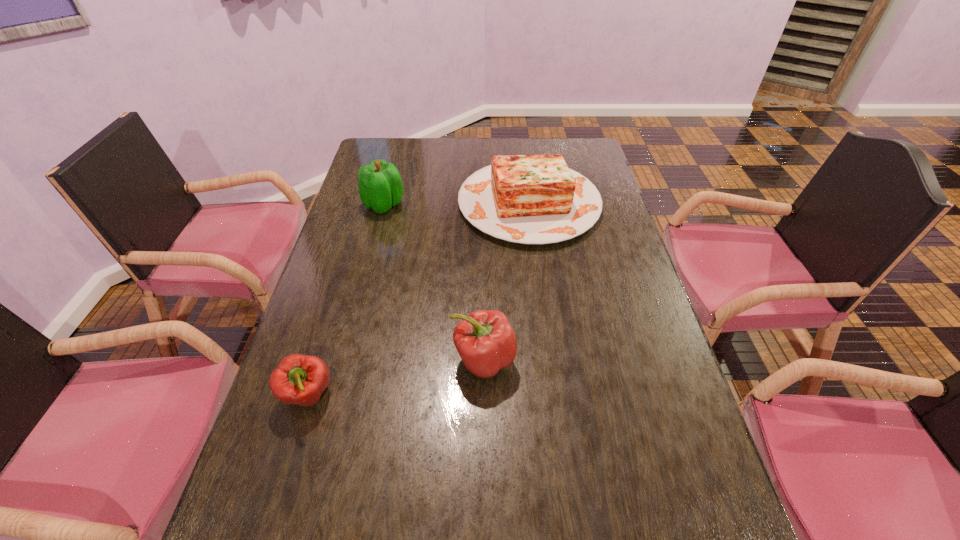
Where is `vacant space that satisfies the following two spatial constraints: 1. on the back side of the rightmost bell pepper; 2. on the right side of the shortest object`? vacant space that satisfies the following two spatial constraints: 1. on the back side of the rightmost bell pepper; 2. on the right side of the shortest object is located at coordinates (319, 360).